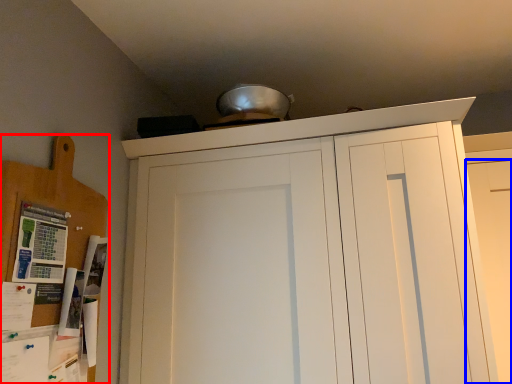
Question: Which of the following is the farthest to the observer, cabinetry (highlighted by a red box) or door (highlighted by a blue box)?

Choices:
 (A) cabinetry
 (B) door

Answer: (B)